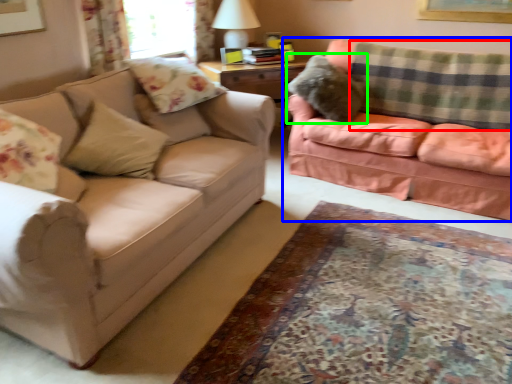
Question: Which is farther away from plaid (highlighted by a red box)? studio couch (highlighted by a blue box) or pillow (highlighted by a green box)?

Choices:
 (A) studio couch
 (B) pillow

Answer: (B)